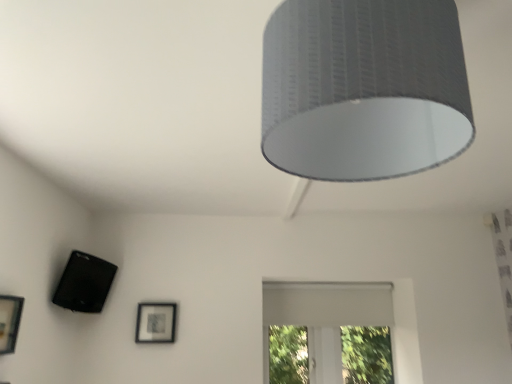
Question: In the image, is matte black picture frame at lower center, which ranks as the second picture frame in top-to-bottom order, on the left side or the right side of white matte window at center?

Choices:
 (A) right
 (B) left

Answer: (B)

Question: From the image's perspective, is matte black picture frame at lower center, which appears as the first picture frame when viewed from the back, located above or below white matte window at center?

Choices:
 (A) above
 (B) below

Answer: (A)

Question: Estimate the real-world distances between objects in this image. Which object is farther from the black matte speaker at lower left?

Choices:
 (A) matte black picture frame at lower left, the first picture frame viewed from the front
 (B) white matte window at center
 (C) textured gray lampshade at upper center
 (D) matte black picture frame at lower center, which appears as the second picture frame when viewed from the front

Answer: (C)

Question: Estimate the real-world distances between objects in this image. Which object is closer to the white matte window at center?

Choices:
 (A) textured gray lampshade at upper center
 (B) matte black picture frame at lower left, arranged as the 2th picture frame when ordered from the bottom
 (C) black matte speaker at lower left
 (D) matte black picture frame at lower center, which appears as the second picture frame when viewed from the front

Answer: (D)